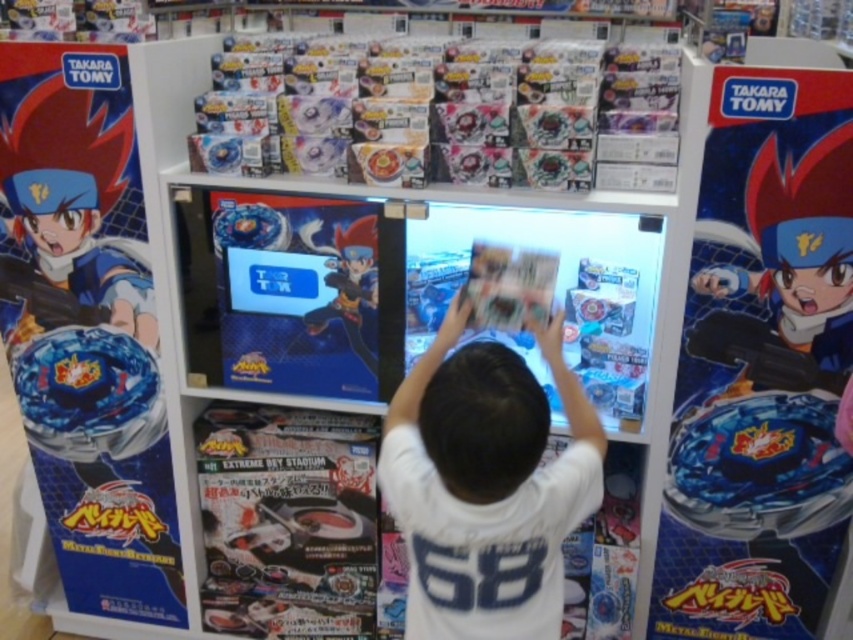
You are a customer in the store looking at the display. You see the white cotton shirt at center and the shiny blue figure at center. Which item is positioned higher?

The shiny blue figure at center is positioned higher than the white cotton shirt at center.

You are a customer in the store and want to know what is at the center of the display. According to the image, what is located at the point with coordinates (486, 484)?

The point at coordinates (486, 484) corresponds to the white cotton shirt at center.

You are a customer in the store and you see the white cotton shirt at center and the shiny blue figure at center. Which one is positioned more to the right side of the display?

The white cotton shirt at center is positioned to the right of the shiny blue figure at center, so the white cotton shirt at center is more to the right side of the display.